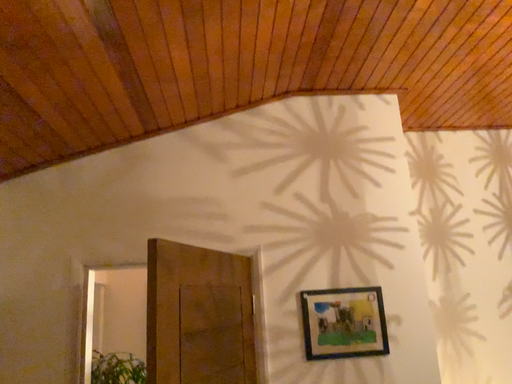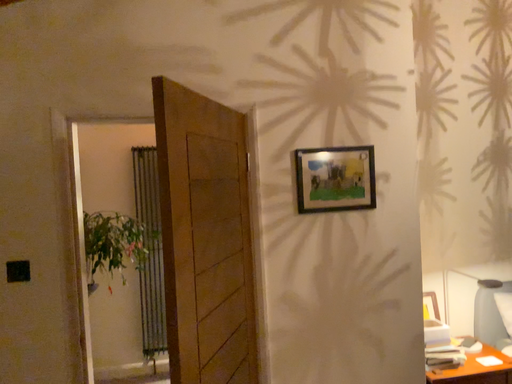
Question: How did the camera likely rotate when shooting the video?

Choices:
 (A) rotated upward
 (B) rotated downward

Answer: (B)